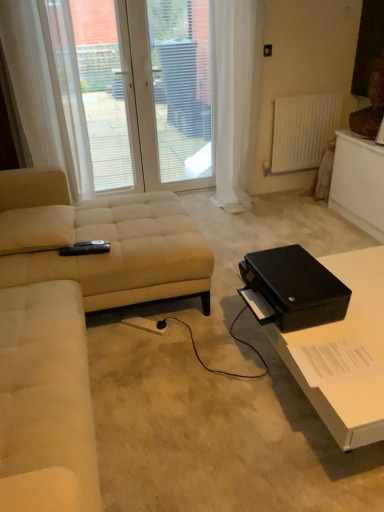
Question: From a real-world perspective, is white plastic screen door at upper center above or below white glossy table at lower right?

Choices:
 (A) above
 (B) below

Answer: (A)

Question: In terms of width, does white plastic screen door at upper center look wider or thinner when compared to white glossy table at lower right?

Choices:
 (A) wide
 (B) thin

Answer: (B)

Question: Which object is positioned farthest from the white glossy table at lower right?

Choices:
 (A) beige fabric studio couch at left
 (B) white fabric curtain at right, positioned as the second curtain in left-to-right order
 (C) white sheer curtain at upper center
 (D) white matte radiator at upper right
 (E) white sheer curtain at left, which appears as the 1th curtain when viewed from the left

Answer: (C)

Question: Which object is positioned farthest from the black matte box at right?

Choices:
 (A) white fabric curtain at right, positioned as the second curtain in left-to-right order
 (B) white glossy table at lower right
 (C) white matte radiator at upper right
 (D) white plastic screen door at upper center
 (E) white sheer curtain at upper center

Answer: (D)